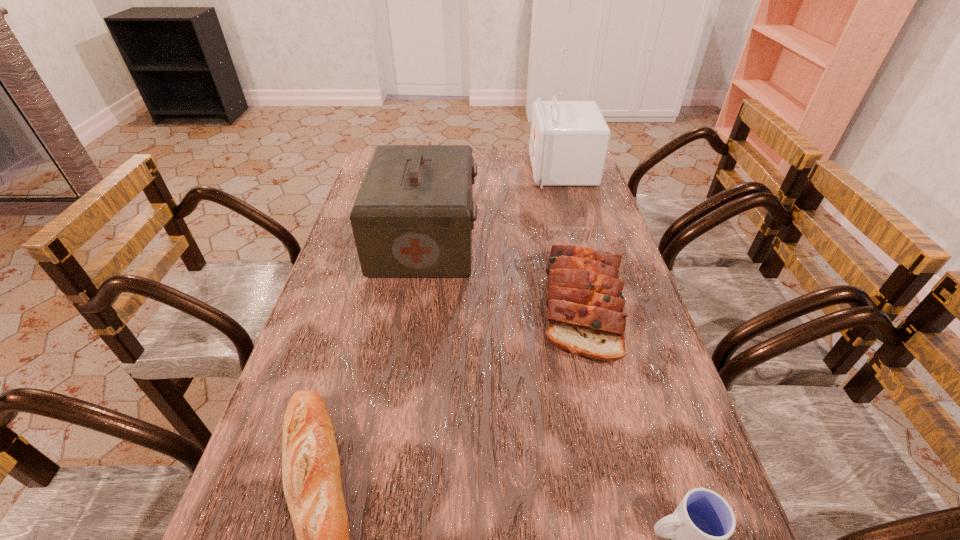
Where is `the farthest object`? The image size is (960, 540). the farthest object is located at coordinates (569, 140).

You are a GUI agent. You are given a task and a screenshot of the screen. Output one action in this format:
    pyautogui.click(x=<x>, y=<y>)
    Task: Click on the right first-aid kit
    The height and width of the screenshot is (540, 960).
    Given the screenshot: What is the action you would take?
    pyautogui.click(x=569, y=140)

Find the location of a particular element. Image resolution: width=960 pixels, height=540 pixels. the nearer first-aid kit is located at coordinates (413, 216).

Locate an element on the screen. The image size is (960, 540). bread is located at coordinates (585, 312).

Image resolution: width=960 pixels, height=540 pixels. I want to click on vacant region located on the front-facing side of the farther first-aid kit, so click(x=421, y=170).

Identify the location of free space located 0.220m on the front-facing side of the farther first-aid kit. This screenshot has width=960, height=540. (470, 170).

Find the location of a particular element. free space located 0.260m on the front-facing side of the farther first-aid kit is located at coordinates (460, 170).

Locate an element on the screen. vacant space located on the back of the left first-aid kit is located at coordinates (435, 171).

The width and height of the screenshot is (960, 540). Find the location of `free space located on the left of the bread`. free space located on the left of the bread is located at coordinates (499, 305).

In order to click on object that is at the far edge in this screenshot , I will do `click(569, 140)`.